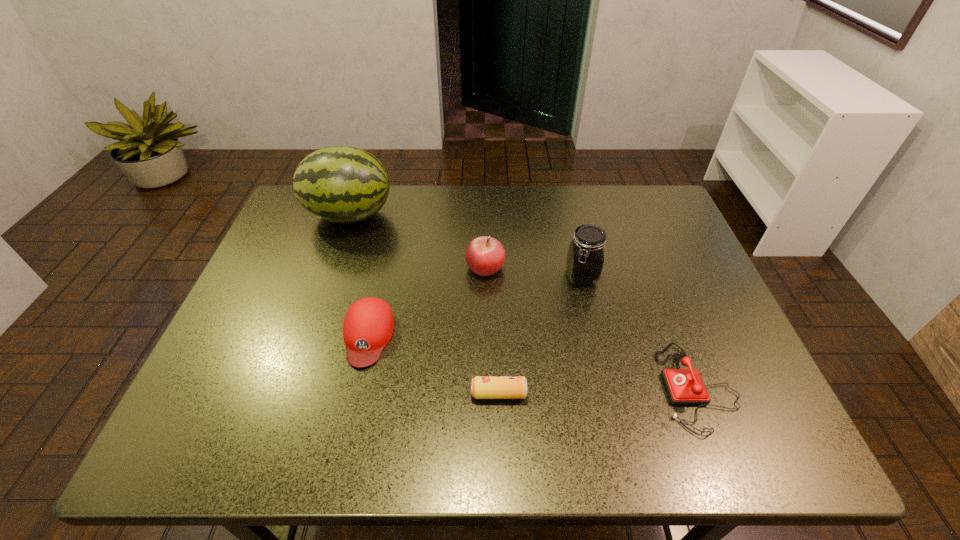
Locate an element on the screen. Image resolution: width=960 pixels, height=540 pixels. object located in the right edge section of the desktop is located at coordinates (684, 386).

At what (x,y) coordinates should I click in order to perform the action: click on object that is at the far left corner. Please return your answer as a coordinate pair (x, y). Looking at the image, I should click on (341, 184).

This screenshot has width=960, height=540. Identify the location of object that is positioned at the near right corner. (684, 386).

This screenshot has width=960, height=540. Identify the location of vacant area at the far edge. (493, 194).

This screenshot has width=960, height=540. I want to click on free space at the near edge of the desktop, so click(x=432, y=426).

In the image, there is a desktop. Where is `vacant space at the left edge`? The width and height of the screenshot is (960, 540). vacant space at the left edge is located at coordinates (247, 395).

Locate an element on the screen. This screenshot has height=540, width=960. vacant position at the right edge of the desktop is located at coordinates (702, 366).

The width and height of the screenshot is (960, 540). Identify the location of vacant area at the far left corner of the desktop. (330, 222).

This screenshot has height=540, width=960. In the image, there is a desktop. Identify the location of blank space at the near right corner. (702, 423).

The height and width of the screenshot is (540, 960). What are the coordinates of `vacant area between the beer can and the fourth shortest object` in the screenshot? It's located at (492, 330).